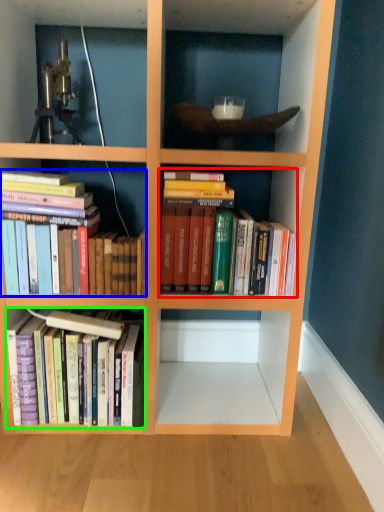
Question: Which object is positioned farthest from book (highlighted by a red box)? Select from book (highlighted by a blue box) and book (highlighted by a green box).

Choices:
 (A) book
 (B) book

Answer: (B)